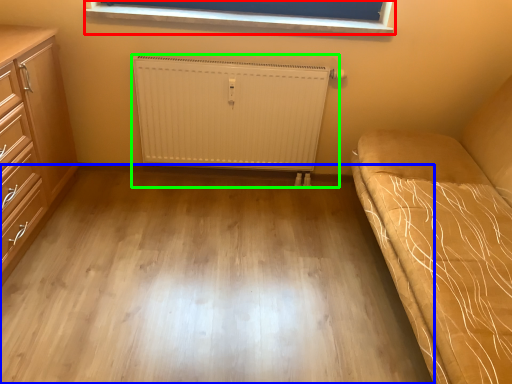
Question: Based on their relative distances, which object is nearer to window (highlighted by a red box)? Choose from plain (highlighted by a blue box) and radiator (highlighted by a green box).

Choices:
 (A) plain
 (B) radiator

Answer: (B)